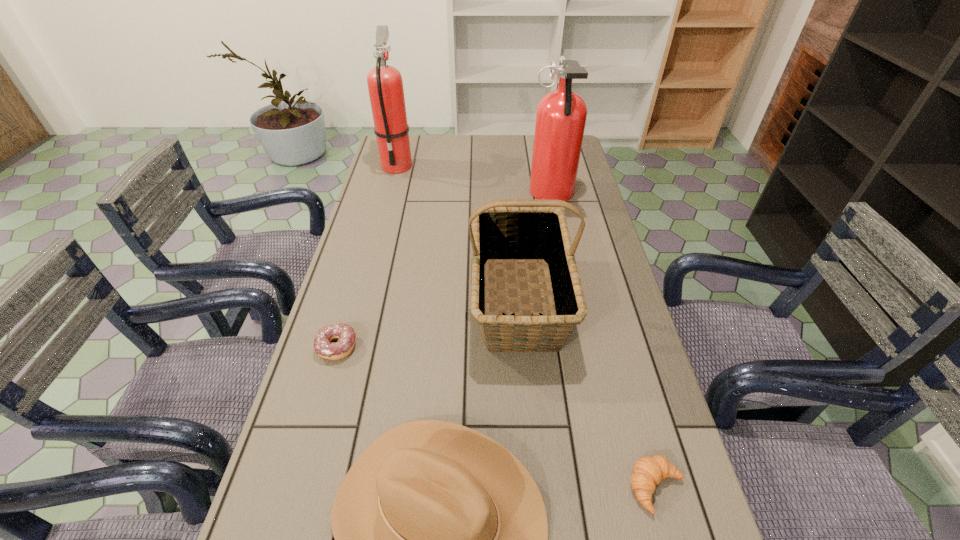
Locate an element on the screen. vacant area that lies between the doughnut and the left fire extinguisher is located at coordinates (368, 256).

The image size is (960, 540). I want to click on vacant point located between the left fire extinguisher and the doughnut, so click(x=368, y=256).

Find the location of a particular element. The width and height of the screenshot is (960, 540). free space between the basket and the crescent roll is located at coordinates (588, 394).

Locate an element on the screen. Image resolution: width=960 pixels, height=540 pixels. vacant area that lies between the doughnut and the left fire extinguisher is located at coordinates (368, 256).

The width and height of the screenshot is (960, 540). What are the coordinates of `free spot between the left fire extinguisher and the third tallest object` in the screenshot? It's located at (459, 233).

Choose which object is the fourth nearest neighbor to the doughnut. Please provide its 2D coordinates. Your answer should be formatted as a tuple, i.e. [(x, y)], where the tuple contains the x and y coordinates of a point satisfying the conditions above.

[(561, 115)]

At what (x,y) coordinates should I click in order to perform the action: click on object that can be found as the second closest to the doughnut. Please return your answer as a coordinate pair (x, y). This screenshot has height=540, width=960. Looking at the image, I should click on (509, 231).

Where is `vacant area in the image that satisfies the following two spatial constraints: 1. on the hose direction of the left fire extinguisher; 2. on the right side of the crescent roll`? The height and width of the screenshot is (540, 960). vacant area in the image that satisfies the following two spatial constraints: 1. on the hose direction of the left fire extinguisher; 2. on the right side of the crescent roll is located at coordinates (312, 488).

Image resolution: width=960 pixels, height=540 pixels. What are the coordinates of `blank area in the image that satisfies the following two spatial constraints: 1. on the hose direction of the crescent roll; 2. on the left side of the left fire extinguisher` in the screenshot? It's located at (312, 488).

Where is `free space that satisfies the following two spatial constraints: 1. on the hose direction of the left fire extinguisher; 2. on the right side of the right fire extinguisher`? The image size is (960, 540). free space that satisfies the following two spatial constraints: 1. on the hose direction of the left fire extinguisher; 2. on the right side of the right fire extinguisher is located at coordinates (389, 195).